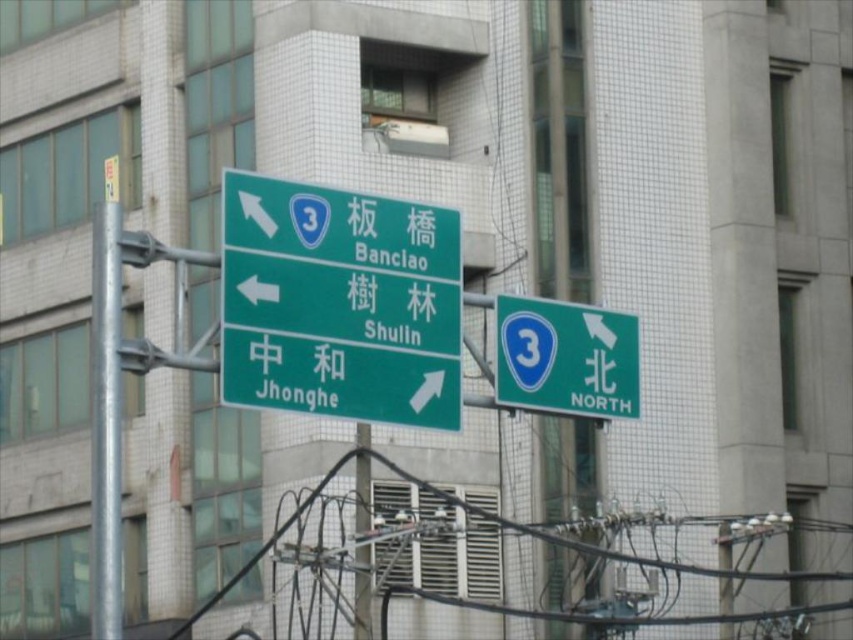
Question: Which point is closer to the camera?

Choices:
 (A) metallic pole at center
 (B) green glossy road sign at upper right

Answer: (B)

Question: Can you confirm if green glossy signboard at upper center is wider than green glossy signboard at center?

Choices:
 (A) no
 (B) yes

Answer: (A)

Question: Which object is the closest to the green glossy road sign at upper right?

Choices:
 (A) galvanized metal pole at left
 (B) metallic pole at center
 (C) green glossy signboard at center
 (D) green glossy signboard at upper center

Answer: (C)

Question: Is galvanized metal pole at left smaller than metallic pole at center?

Choices:
 (A) no
 (B) yes

Answer: (A)

Question: Is galvanized metal pole at left below metallic pole at center?

Choices:
 (A) yes
 (B) no

Answer: (B)

Question: Which object appears farthest from the camera in this image?

Choices:
 (A) galvanized metal pole at left
 (B) green glossy road sign at upper right
 (C) green glossy signboard at upper center

Answer: (B)